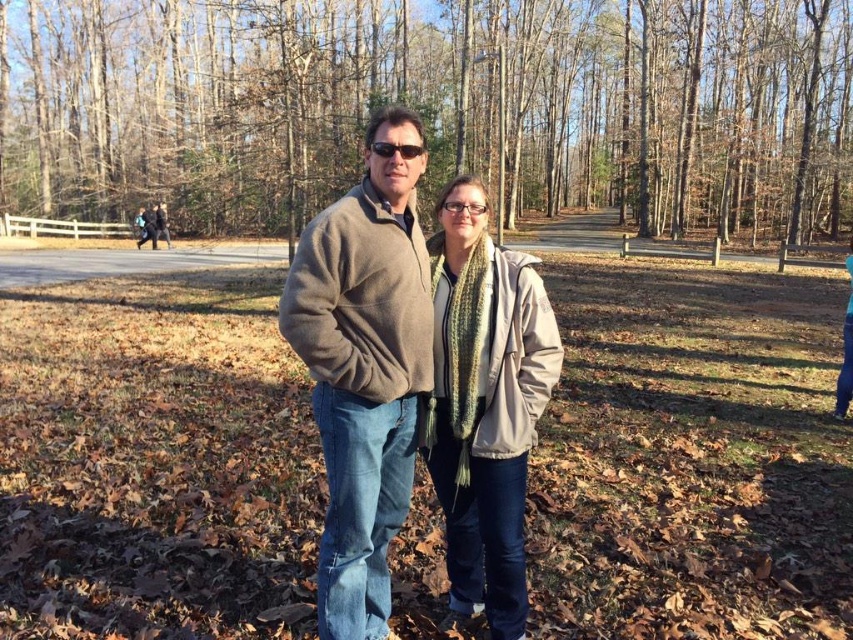
You are a photographer trying to capture both the brown woolen sweater at center and the brown textured tree at center in a single frame. Given their sizes, which object will appear larger in your photo?

The brown textured tree at center will appear larger in the photo because it is bigger than the brown woolen sweater at center.

You are a photographer trying to capture a clear photo of the sunglasses at center. However, the brown fleece jacket at center is blocking your view. Can you move the jacket to get a clear shot?

The brown fleece jacket at center is in front of the sunglasses at center, so moving the jacket would allow you to see the sunglasses at center clearly.